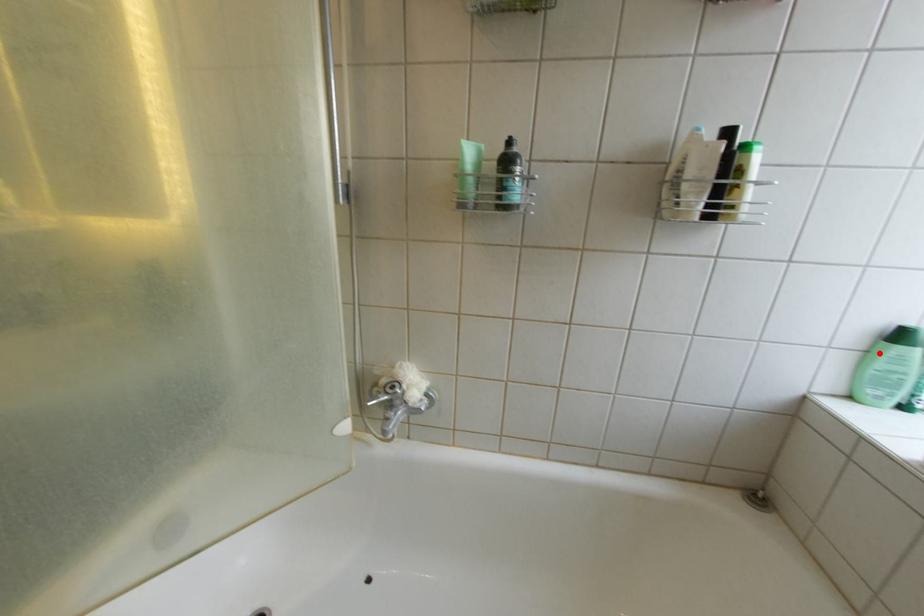
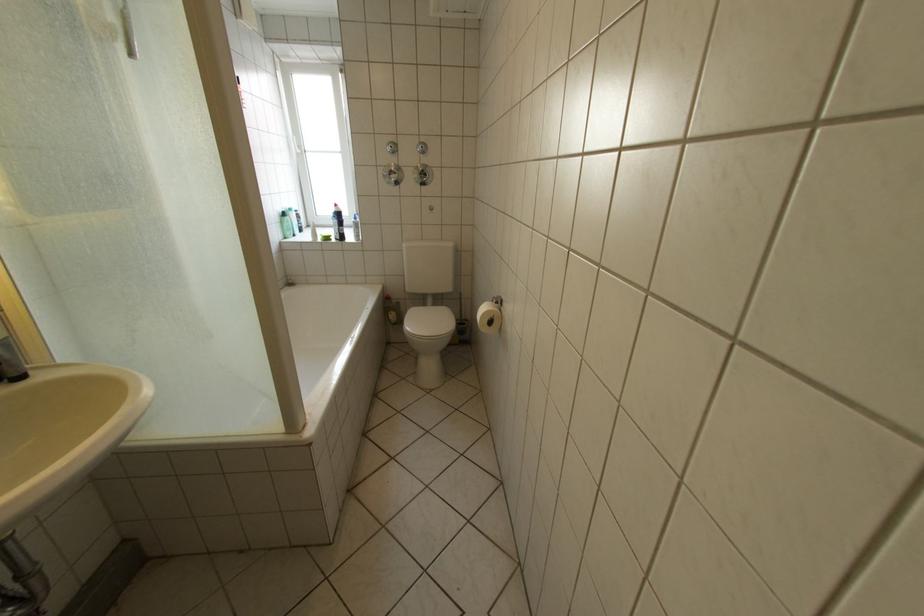
Question: I am providing you with two images of the same scene from different viewpoints. Given a red point in image1, look at the same physical point in image2. Is it:

Choices:
 (A) Closer to the viewpoint
 (B) Farther from the viewpoint

Answer: (A)